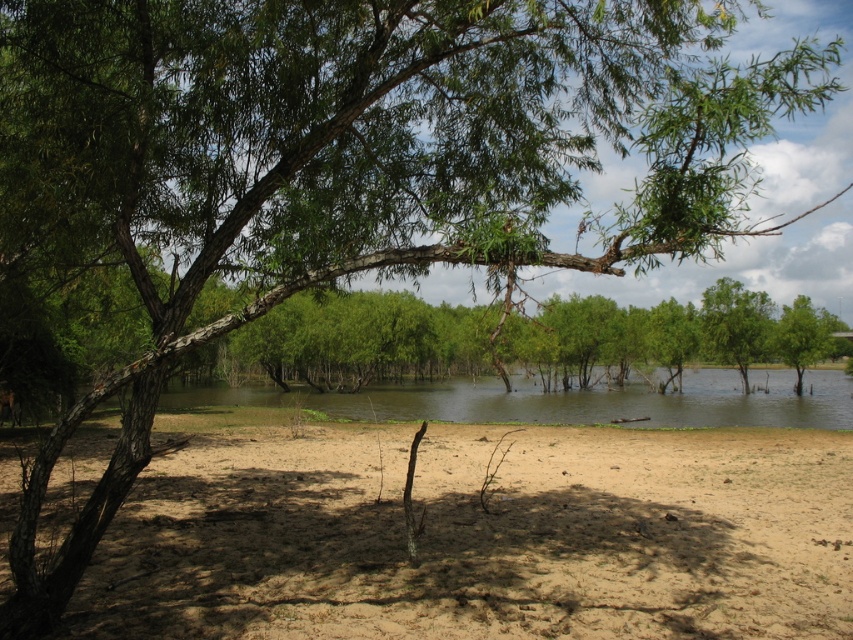
Does brown sandy dirt at lower center have a greater width compared to clear water at center?

No, brown sandy dirt at lower center is not wider than clear water at center.

Describe the element at coordinates (480, 536) in the screenshot. This screenshot has width=853, height=640. I see `brown sandy dirt at lower center` at that location.

Is point (283, 577) positioned before point (784, 374)?

Yes, point (283, 577) is closer to viewer.

Locate an element on the screen. brown sandy dirt at lower center is located at coordinates (480, 536).